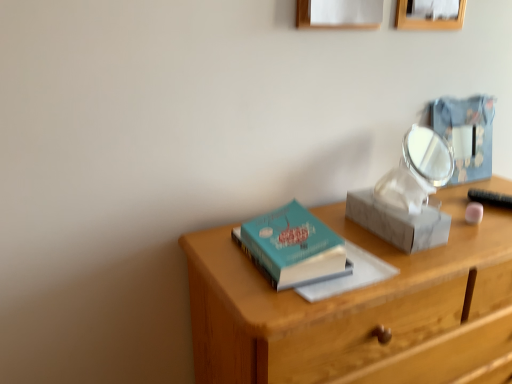
Question: Considering the relative positions of wooden desk at center and wooden picture frame at upper center, the 2th picture frame viewed from the left, in the image provided, is wooden desk at center to the left or to the right of wooden picture frame at upper center, the 2th picture frame viewed from the left,?

Choices:
 (A) left
 (B) right

Answer: (A)

Question: From the image's perspective, is wooden desk at center located above or below wooden picture frame at upper center, the 2th picture frame viewed from the left?

Choices:
 (A) above
 (B) below

Answer: (B)

Question: Considering the real-world distances, which object is farthest from the white paper at upper center, marked as the first picture frame in a left-to-right arrangement?

Choices:
 (A) metallic blue box at upper right
 (B) wooden desk at center
 (C) teal matte hardcover book at center
 (D) wooden picture frame at upper center, the 2th picture frame viewed from the left
 (E) white marble shoe box at center-right

Answer: (B)

Question: Which of these objects is positioned farthest from the wooden picture frame at upper center, the 2th picture frame viewed from the left?

Choices:
 (A) teal matte hardcover book at center
 (B) metallic blue box at upper right
 (C) wooden desk at center
 (D) white paper at upper center, which is the second picture frame in right-to-left order
 (E) white marble shoe box at center-right

Answer: (C)